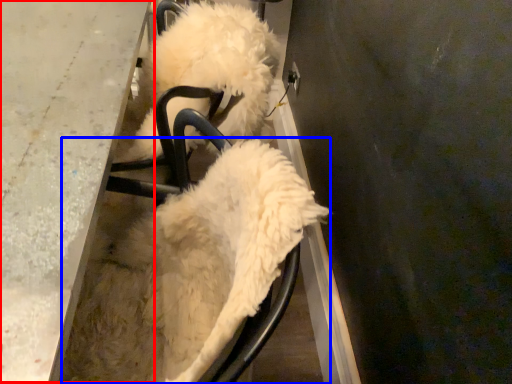
Question: Which point is further to the camera, table (highlighted by a red box) or dog (highlighted by a blue box)?

Choices:
 (A) table
 (B) dog

Answer: (A)